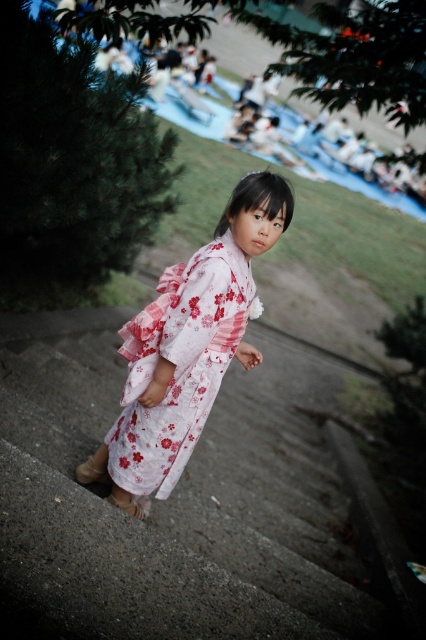
Measure the distance between concrete stairs at center and white floral kimono at center.

concrete stairs at center is 1.02 meters away from white floral kimono at center.

Which is more to the right, concrete stairs at center or white floral kimono at center?

Positioned to the right is concrete stairs at center.

Who is more distant from viewer, (x=106, y=362) or (x=129, y=454)?

Point (x=106, y=362)

Locate an element on the screen. concrete stairs at center is located at coordinates (178, 509).